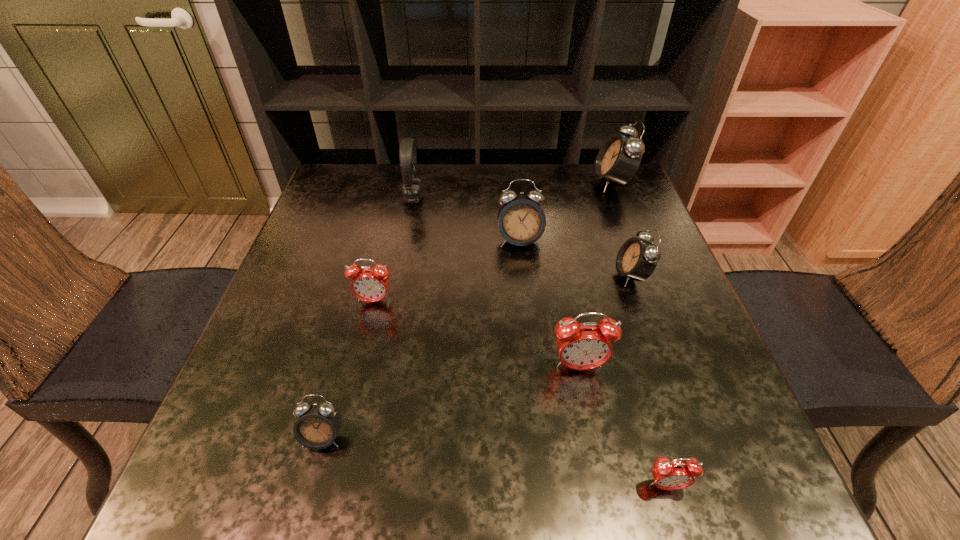
The image size is (960, 540). Identify the location of vacant space that's between the leftmost red alarm clock and the sixth nearest alarm clock. (446, 271).

The image size is (960, 540). Identify the location of free space that is in between the fourth nearest alarm clock and the third farthest object. (446, 271).

What are the coordinates of `free space between the rightmost red alarm clock and the nearest white alarm clock` in the screenshot? It's located at (494, 461).

This screenshot has height=540, width=960. In order to click on vacant space that's between the sixth farthest alarm clock and the farthest alarm clock in this screenshot , I will do `click(468, 310)`.

Locate an element on the screen. This screenshot has width=960, height=540. free space between the leftmost red alarm clock and the smallest white alarm clock is located at coordinates (348, 369).

Where is `vacant space in between the farthest alarm clock and the fourth nearest alarm clock`? The image size is (960, 540). vacant space in between the farthest alarm clock and the fourth nearest alarm clock is located at coordinates (492, 242).

This screenshot has width=960, height=540. I want to click on free spot between the second smallest white alarm clock and the second biggest red alarm clock, so click(503, 288).

Select which object is the fifth closest to the third nearest object. Please provide its 2D coordinates. Your answer should be formatted as a tuple, i.e. [(x, y)], where the tuple contains the x and y coordinates of a point satisfying the conditions above.

[(318, 423)]

Identify which object is located as the seventh nearest to the headset. Please provide its 2D coordinates. Your answer should be formatted as a tuple, i.e. [(x, y)], where the tuple contains the x and y coordinates of a point satisfying the conditions above.

[(676, 474)]

Choose which alarm clock is the fourth nearest neighbor to the farthest red alarm clock. Please provide its 2D coordinates. Your answer should be formatted as a tuple, i.e. [(x, y)], where the tuple contains the x and y coordinates of a point satisfying the conditions above.

[(637, 259)]